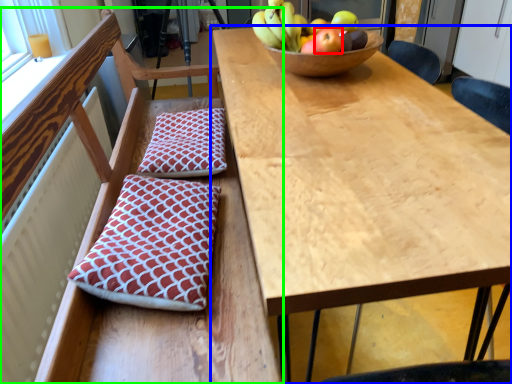
Question: Which object is the closest to the apple (highlighted by a red box)? Choose among these: table (highlighted by a blue box) or chair (highlighted by a green box).

Choices:
 (A) table
 (B) chair

Answer: (A)